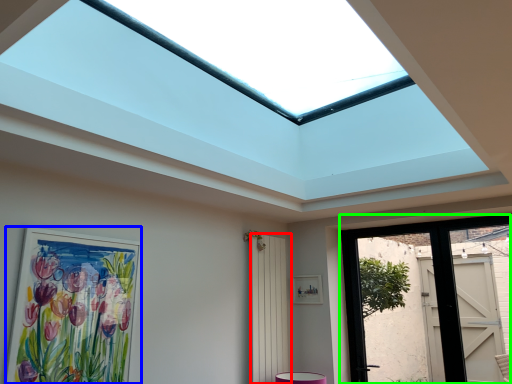
Question: Estimate the real-world distances between objects in this image. Which object is farther from screen door (highlighted by a red box), picture frame (highlighted by a blue box) or door (highlighted by a green box)?

Choices:
 (A) picture frame
 (B) door

Answer: (A)